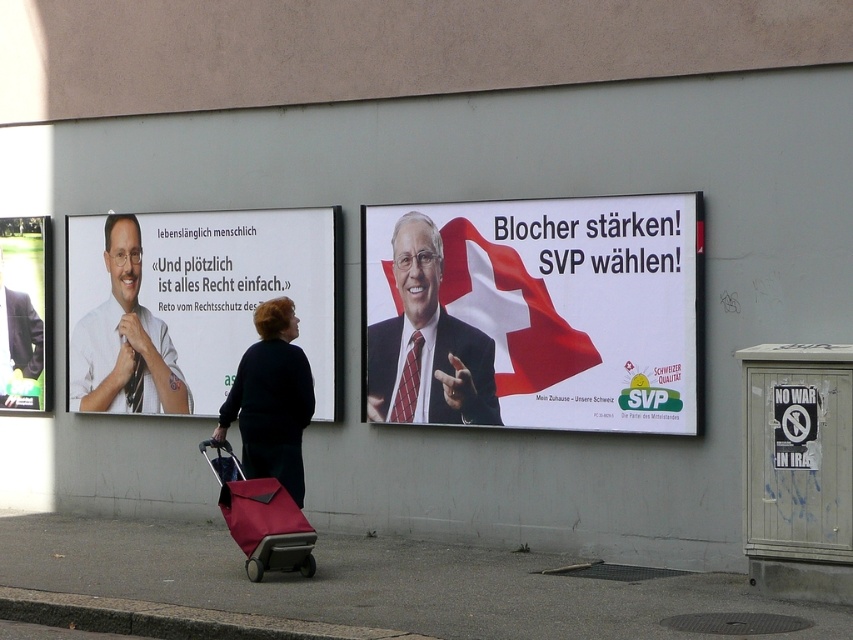
You are a street artist planning to place a new sticker on the matte white poster at left and the matte red suitcase at center. Since you want to ensure your sticker will be visible, you need to know which object is wider. Which one is wider?

The matte white poster at left is wider than the matte red suitcase at center, so placing the sticker on the matte white poster at left would ensure better visibility.

You are a photographer trying to capture the political campaign poster of Reto. You need to ensure the red tie at center and the matte white shirt at left are both in focus. Which object should you focus on first if you want to capture both in the same frame?

The red tie at center is to the right of matte white shirt at left. To capture both in focus, you should focus on the matte white shirt at left first since it is closer to the camera, allowing the red tie at center to remain in the depth of field.

You are standing at the point marked as point (131, 282) in the image. You want to move to the nearest exit which is located 50 feet away from you. Can you reach the exit without moving past the posters?

The point marked as point (131, 282) is 41.38 feet away from the viewer. Since the exit is 50 feet away, you can reach it without moving past the posters as the distance is sufficient.